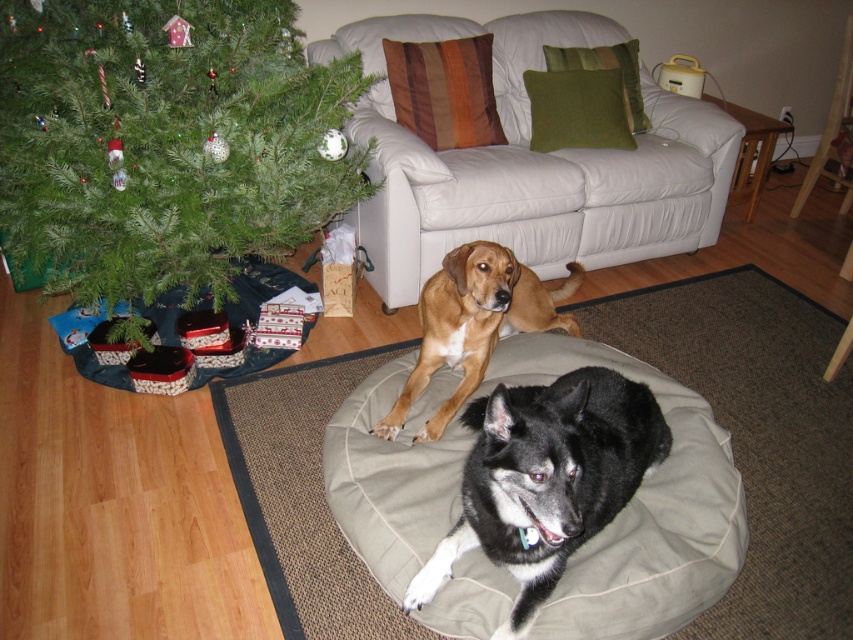
From the picture: You are a guest entering the room and see the black fur dog at center and the green textured pillow at upper center. Which object is closer to you?

The black fur dog at center is closer to you because it is positioned under the green textured pillow at upper center, meaning the dog is in front of the pillow from your viewpoint.

Looking at this image, you are a delivery person who just arrived at the house and need to place a new package on the floor between the brown furry dog at center and the Christmas tree. The package is 2 feet long. Can you fit it in the space between them?

The distance between the brown furry dog at center and the Christmas tree is 6.27 feet, so yes, the 2 feet long package can be placed in the space between them as there is enough room.